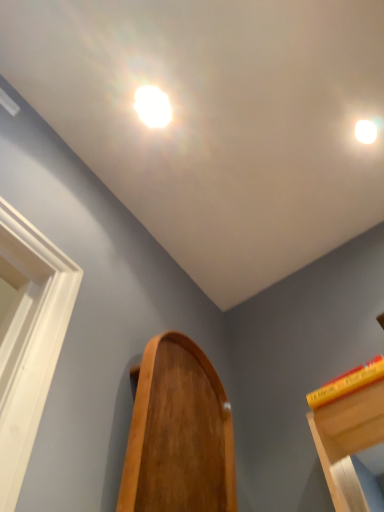
Looking at this image, measure the distance between point (x=370, y=371) and camera.

1.18 meters.

Find the location of a particular element. This screenshot has height=512, width=384. wooden mirror at center is located at coordinates (179, 434).

This screenshot has height=512, width=384. What do you see at coordinates (179, 434) in the screenshot? I see `wooden mirror at center` at bounding box center [179, 434].

Describe the element at coordinates (152, 106) in the screenshot. The height and width of the screenshot is (512, 384). I see `white glossy droplight at upper center, positioned as the second droplight in back-to-front order` at that location.

Locate an element on the screen. The image size is (384, 512). yellow matte book at upper right is located at coordinates (347, 383).

Which of these two, yellow matte book at upper right or white glossy droplight at upper center, positioned as the second droplight in back-to-front order, is wider?

With larger width is yellow matte book at upper right.

Measure the distance between yellow matte book at upper right and white glossy droplight at upper center, arranged as the 1th droplight when viewed from the left.

yellow matte book at upper right is 3.46 feet from white glossy droplight at upper center, arranged as the 1th droplight when viewed from the left.

Is yellow matte book at upper right positioned beyond the bounds of white glossy droplight at upper center, the first droplight in the front-to-back sequence?

That's correct, yellow matte book at upper right is outside of white glossy droplight at upper center, the first droplight in the front-to-back sequence.

In the image, is yellow matte book at upper right positioned in front of or behind white glossy droplight at upper center, positioned as the second droplight in back-to-front order?

yellow matte book at upper right is positioned closer to the viewer than white glossy droplight at upper center, positioned as the second droplight in back-to-front order.

Does white glossy droplight at upper right, the 1th droplight in the right-to-left sequence, lie behind white glossy droplight at upper center, arranged as the 1th droplight when viewed from the left?

Yes, the depth of white glossy droplight at upper right, the 1th droplight in the right-to-left sequence, is greater than that of white glossy droplight at upper center, arranged as the 1th droplight when viewed from the left.

Locate an element on the screen. droplight located behind the white glossy droplight at upper center, which is the second droplight from right to left is located at coordinates (365, 131).

Which is correct: white glossy droplight at upper right, the 1th droplight in the right-to-left sequence, is inside white glossy droplight at upper center, which is the second droplight from right to left, or outside of it?

The correct answer is: outside.

Considering the positions of point (363, 135) and point (159, 99), is point (363, 135) closer or farther from the camera than point (159, 99)?

Point (363, 135) is farther from the camera than point (159, 99).

Considering the sizes of objects wooden mirror at center and white glossy droplight at upper right, marked as the second droplight in a left-to-right arrangement, in the image provided, who is bigger, wooden mirror at center or white glossy droplight at upper right, marked as the second droplight in a left-to-right arrangement,?

With larger size is wooden mirror at center.

Between wooden mirror at center and white glossy droplight at upper right, the 1th droplight in the right-to-left sequence, which one has more height?

With more height is wooden mirror at center.

Is wooden mirror at center beside white glossy droplight at upper right, placed as the 2th droplight when sorted from front to back?

No, wooden mirror at center is not touching white glossy droplight at upper right, placed as the 2th droplight when sorted from front to back.

Where is `furniture located in front of the white glossy droplight at upper right, which is counted as the first droplight, starting from the back`? This screenshot has height=512, width=384. furniture located in front of the white glossy droplight at upper right, which is counted as the first droplight, starting from the back is located at coordinates (179, 434).

Considering the relative sizes of white glossy droplight at upper center, positioned as the second droplight in back-to-front order, and white glossy droplight at upper right, which is counted as the first droplight, starting from the back, in the image provided, is white glossy droplight at upper center, positioned as the second droplight in back-to-front order, wider than white glossy droplight at upper right, which is counted as the first droplight, starting from the back,?

Yes.

From the image's perspective, is white glossy droplight at upper center, positioned as the second droplight in back-to-front order, under white glossy droplight at upper right, placed as the 2th droplight when sorted from front to back?

Incorrect, from the image's perspective, white glossy droplight at upper center, positioned as the second droplight in back-to-front order, is higher than white glossy droplight at upper right, placed as the 2th droplight when sorted from front to back.

From a real-world perspective, is white glossy droplight at upper center, arranged as the 1th droplight when viewed from the left, below white glossy droplight at upper right, the 1th droplight in the right-to-left sequence?

Correct, in the physical world, white glossy droplight at upper center, arranged as the 1th droplight when viewed from the left, is lower than white glossy droplight at upper right, the 1th droplight in the right-to-left sequence.

Are white glossy droplight at upper center, which is the second droplight from right to left, and white glossy droplight at upper right, placed as the 2th droplight when sorted from front to back, far apart?

No, white glossy droplight at upper center, which is the second droplight from right to left, is not far from white glossy droplight at upper right, placed as the 2th droplight when sorted from front to back.

From a real-world perspective, is yellow matte book at upper right physically below wooden mirror at center?

No, from a real-world perspective, yellow matte book at upper right is not under wooden mirror at center.

Considering the relative sizes of yellow matte book at upper right and wooden mirror at center in the image provided, is yellow matte book at upper right bigger than wooden mirror at center?

No.

In the scene shown: Relative to wooden mirror at center, is yellow matte book at upper right in front or behind?

yellow matte book at upper right is positioned farther from the viewer than wooden mirror at center.

Is wooden mirror at center at the back of yellow matte book at upper right?

yellow matte book at upper right is not turned away from wooden mirror at center.

Is white glossy droplight at upper right, placed as the 2th droplight when sorted from front to back, next to wooden mirror at center?

No, white glossy droplight at upper right, placed as the 2th droplight when sorted from front to back, is not touching wooden mirror at center.

Is point (372, 135) farther from camera compared to point (178, 462)?

Yes, point (372, 135) is farther from viewer.

Is white glossy droplight at upper right, placed as the 2th droplight when sorted from front to back, not inside wooden mirror at center?

Indeed, white glossy droplight at upper right, placed as the 2th droplight when sorted from front to back, is completely outside wooden mirror at center.

Considering the sizes of wooden mirror at center and yellow matte book at upper right in the image, is wooden mirror at center wider or thinner than yellow matte book at upper right?

wooden mirror at center is thinner than yellow matte book at upper right.

Is wooden mirror at center next to yellow matte book at upper right?

No.

From the picture: Is wooden mirror at center in front of or behind yellow matte book at upper right in the image?

wooden mirror at center is positioned closer to the viewer than yellow matte book at upper right.

Visually, is wooden mirror at center positioned to the left or to the right of yellow matte book at upper right?

In the image, wooden mirror at center appears on the left side of yellow matte book at upper right.

Where is `droplight that is the 1st one when counting backward from the yellow matte book at upper right`? This screenshot has width=384, height=512. droplight that is the 1st one when counting backward from the yellow matte book at upper right is located at coordinates (152, 106).

At what (x,y) coordinates should I click in order to perform the action: click on droplight that appears on the right of white glossy droplight at upper center, positioned as the second droplight in back-to-front order. Please return your answer as a coordinate pair (x, y). Image resolution: width=384 pixels, height=512 pixels. Looking at the image, I should click on (365, 131).

Looking at the image, which one is located closer to wooden mirror at center, white glossy droplight at upper right, placed as the 2th droplight when sorted from front to back, or white glossy droplight at upper center, which is the second droplight from right to left?

white glossy droplight at upper center, which is the second droplight from right to left, is closer to wooden mirror at center.

When comparing their distances from yellow matte book at upper right, does white glossy droplight at upper right, the 1th droplight in the right-to-left sequence, or white glossy droplight at upper center, which is the second droplight from right to left, seem further?

Based on the image, white glossy droplight at upper center, which is the second droplight from right to left, appears to be further to yellow matte book at upper right.

When comparing their distances from white glossy droplight at upper center, arranged as the 1th droplight when viewed from the left, does white glossy droplight at upper right, placed as the 2th droplight when sorted from front to back, or yellow matte book at upper right seem closer?

white glossy droplight at upper right, placed as the 2th droplight when sorted from front to back, is positioned closer to the anchor white glossy droplight at upper center, arranged as the 1th droplight when viewed from the left.

Estimate the real-world distances between objects in this image. Which object is further from white glossy droplight at upper right, placed as the 2th droplight when sorted from front to back, white glossy droplight at upper center, the first droplight in the front-to-back sequence, or wooden mirror at center?

wooden mirror at center.

Looking at the image, which one is located closer to white glossy droplight at upper right, which is counted as the first droplight, starting from the back, wooden mirror at center or white glossy droplight at upper center, which is the second droplight from right to left?

The object closer to white glossy droplight at upper right, which is counted as the first droplight, starting from the back, is white glossy droplight at upper center, which is the second droplight from right to left.

Estimate the real-world distances between objects in this image. Which object is further from white glossy droplight at upper right, placed as the 2th droplight when sorted from front to back, wooden mirror at center or yellow matte book at upper right?

wooden mirror at center is positioned further to the anchor white glossy droplight at upper right, placed as the 2th droplight when sorted from front to back.

From the image, which object appears to be farther from white glossy droplight at upper center, positioned as the second droplight in back-to-front order, wooden mirror at center or white glossy droplight at upper right, placed as the 2th droplight when sorted from front to back?

Based on the image, wooden mirror at center appears to be further to white glossy droplight at upper center, positioned as the second droplight in back-to-front order.

Considering their positions, is yellow matte book at upper right positioned closer to white glossy droplight at upper center, which is the second droplight from right to left, than wooden mirror at center?

wooden mirror at center is closer to white glossy droplight at upper center, which is the second droplight from right to left.

You are a GUI agent. You are given a task and a screenshot of the screen. Output one action in this format:
    pyautogui.click(x=<x>, y=<y>)
    Task: Click on the droplight between white glossy droplight at upper center, which is the second droplight from right to left, and wooden mirror at center from top to bottom
    This screenshot has width=384, height=512.
    Given the screenshot: What is the action you would take?
    pyautogui.click(x=365, y=131)

Locate an element on the screen. This screenshot has width=384, height=512. book between white glossy droplight at upper center, positioned as the second droplight in back-to-front order, and wooden mirror at center from top to bottom is located at coordinates (347, 383).

Where is `droplight between white glossy droplight at upper center, positioned as the second droplight in back-to-front order, and yellow matte book at upper right from top to bottom`? droplight between white glossy droplight at upper center, positioned as the second droplight in back-to-front order, and yellow matte book at upper right from top to bottom is located at coordinates (365, 131).

You are a GUI agent. You are given a task and a screenshot of the screen. Output one action in this format:
    pyautogui.click(x=<x>, y=<y>)
    Task: Click on the book between white glossy droplight at upper right, the 1th droplight in the right-to-left sequence, and wooden mirror at center vertically
    This screenshot has height=512, width=384.
    Given the screenshot: What is the action you would take?
    pyautogui.click(x=347, y=383)